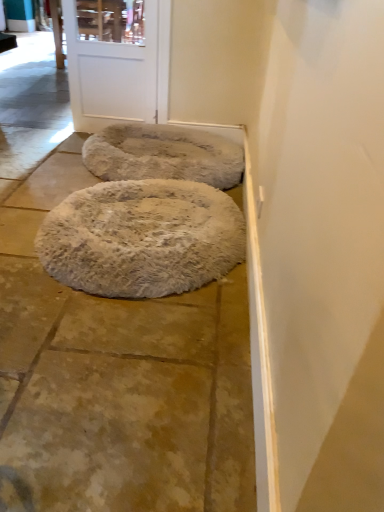
Question: Does white fluffy dog bed at center, which appears as the 1th dog bed when viewed from the front, turn towards white fluffy rug at center?

Choices:
 (A) yes
 (B) no

Answer: (B)

Question: Is white fluffy dog bed at center, the second dog bed viewed from the back, further to camera compared to white fluffy rug at center?

Choices:
 (A) yes
 (B) no

Answer: (A)

Question: Can you confirm if white fluffy dog bed at center, which appears as the 1th dog bed when viewed from the front, is smaller than white fluffy rug at center?

Choices:
 (A) yes
 (B) no

Answer: (A)

Question: Is white fluffy dog bed at center, the second dog bed viewed from the back, facing away from white fluffy rug at center?

Choices:
 (A) yes
 (B) no

Answer: (B)

Question: Is white fluffy dog bed at center, which appears as the 1th dog bed when viewed from the front, to the right of white fluffy rug at center from the viewer's perspective?

Choices:
 (A) no
 (B) yes

Answer: (B)

Question: In terms of width, does white fluffy dog bed at center, which appears as the 1th dog bed when viewed from the front, look wider or thinner when compared to white fluffy rug at center?

Choices:
 (A) wide
 (B) thin

Answer: (B)

Question: Does point (147, 198) appear closer or farther from the camera than point (89, 428)?

Choices:
 (A) closer
 (B) farther

Answer: (B)

Question: From their relative heights in the image, would you say white fluffy dog bed at center, the second dog bed viewed from the back, is taller or shorter than white fluffy rug at center?

Choices:
 (A) tall
 (B) short

Answer: (A)

Question: Relative to white fluffy rug at center, is white fluffy dog bed at center, the second dog bed viewed from the back, in front or behind?

Choices:
 (A) front
 (B) behind

Answer: (B)

Question: Considering their positions, is fuzzy beige dog bed at center, placed as the 1th dog bed when sorted from back to front, located in front of or behind white matte door at upper center?

Choices:
 (A) front
 (B) behind

Answer: (A)

Question: Does point (218, 153) appear closer or farther from the camera than point (150, 36)?

Choices:
 (A) closer
 (B) farther

Answer: (A)

Question: From a real-world perspective, is fuzzy beige dog bed at center, the 2th dog bed positioned from the front, above or below white matte door at upper center?

Choices:
 (A) below
 (B) above

Answer: (A)

Question: Looking at the image, does fuzzy beige dog bed at center, the 2th dog bed positioned from the front, seem bigger or smaller compared to white matte door at upper center?

Choices:
 (A) small
 (B) big

Answer: (B)

Question: From the image's perspective, is white fluffy rug at center positioned above or below white fluffy dog bed at center, which appears as the 1th dog bed when viewed from the front?

Choices:
 (A) above
 (B) below

Answer: (B)

Question: Is white fluffy rug at center in front of or behind white fluffy dog bed at center, which appears as the 1th dog bed when viewed from the front, in the image?

Choices:
 (A) front
 (B) behind

Answer: (A)